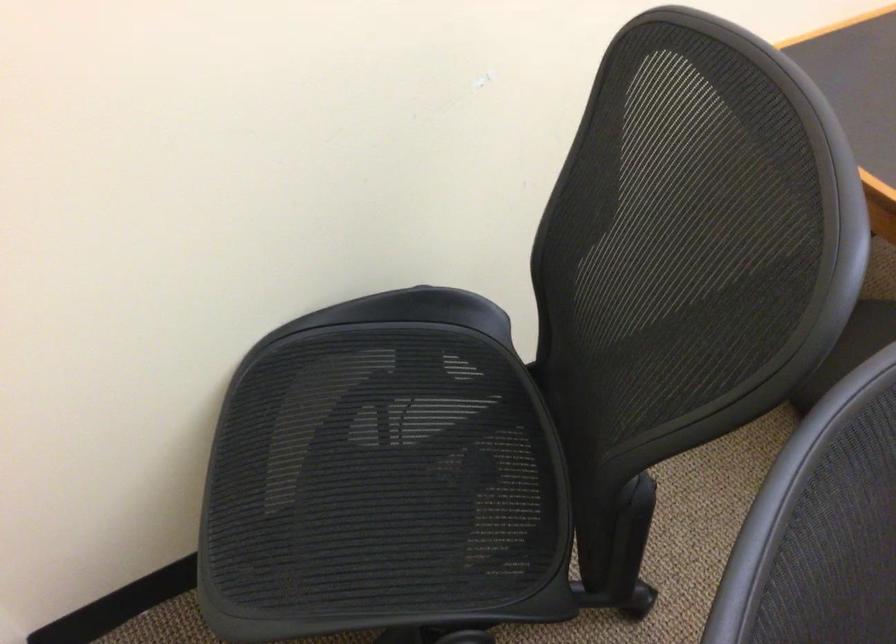
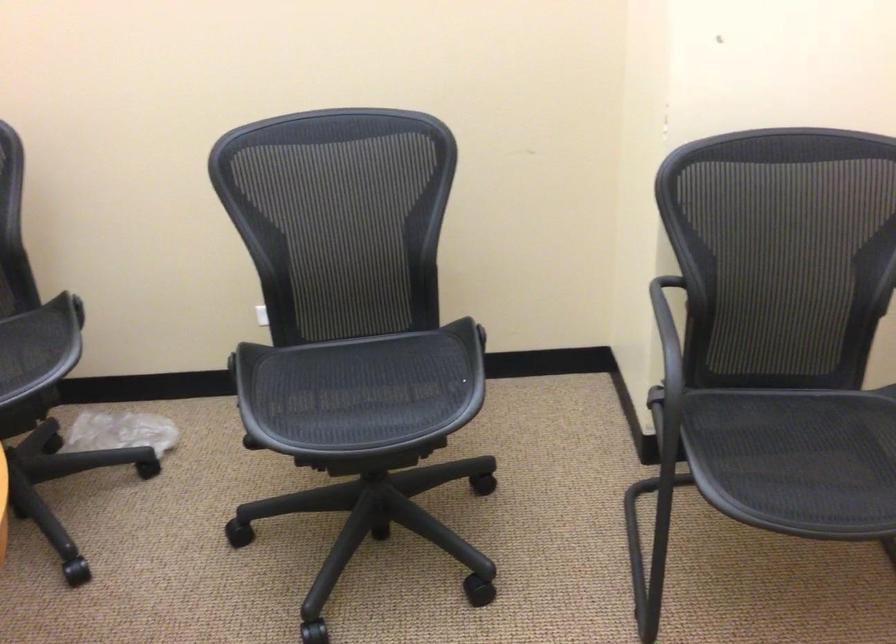
Question: Based on the continuous images, in which direction is the camera rotating? Reply with the corresponding letter.

Choices:
 (A) Left
 (B) Right
 (C) Up
 (D) Down

Answer: (B)